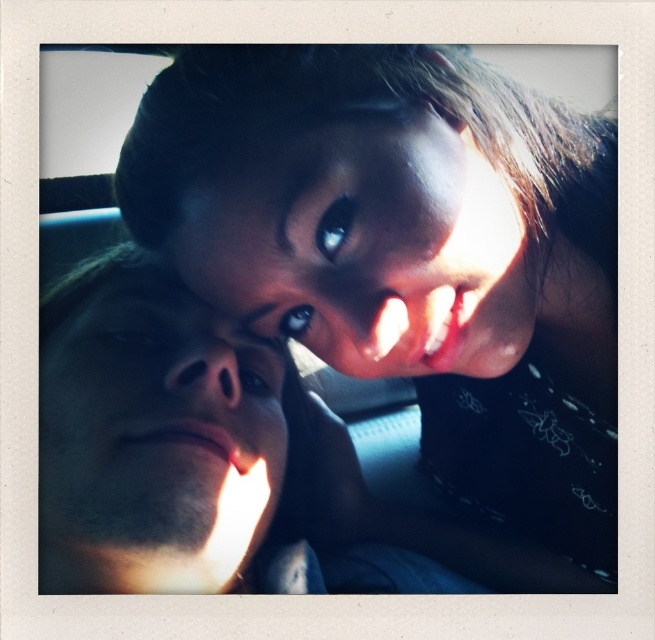
Which is behind, point (291, 456) or point (398, 339)?

The point (291, 456) is behind.

Describe the element at coordinates (164, 440) in the screenshot. I see `smooth skin face at left` at that location.

The image size is (655, 640). I want to click on smooth skin face at left, so click(164, 440).

Which is more to the right, matte black hair at upper center or smooth skin face at left?

matte black hair at upper center is more to the right.

This screenshot has width=655, height=640. Describe the element at coordinates (411, 273) in the screenshot. I see `matte black hair at upper center` at that location.

Is point (333, 312) more distant than point (250, 358)?

No, it is not.

At what (x,y) coordinates should I click in order to perform the action: click on matte black hair at upper center. Please return your answer as a coordinate pair (x, y). This screenshot has height=640, width=655. Looking at the image, I should click on (411, 273).

Does matte black hair at upper center have a greater width compared to smooth skin face at upper center?

Yes, matte black hair at upper center is wider than smooth skin face at upper center.

Consider the image. Who is positioned more to the right, matte black hair at upper center or smooth skin face at upper center?

matte black hair at upper center is more to the right.

Between point (402, 515) and point (257, 285), which one is positioned in front?

Point (257, 285) is in front.

Identify the location of matte black hair at upper center. The width and height of the screenshot is (655, 640). (411, 273).